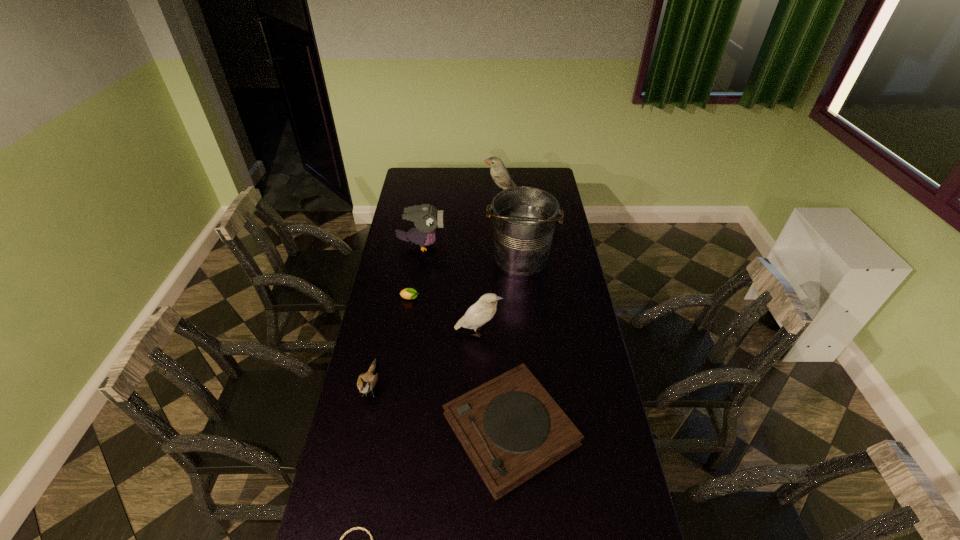
Locate an element on the screen. This screenshot has width=960, height=540. vacant space located at the face of the farthest bird is located at coordinates (468, 194).

Where is `free space located 0.320m at the face of the farthest bird`? The height and width of the screenshot is (540, 960). free space located 0.320m at the face of the farthest bird is located at coordinates (427, 194).

The image size is (960, 540). What are the coordinates of `free region located at the face of the farthest bird` in the screenshot? It's located at (471, 194).

Find the location of a particular element. The height and width of the screenshot is (540, 960). free point located at the beak of the second farthest bird is located at coordinates (527, 246).

Locate an element on the screen. Image resolution: width=960 pixels, height=540 pixels. free location located 0.160m at the beak of the second nearest bird is located at coordinates (542, 332).

Image resolution: width=960 pixels, height=540 pixels. Find the location of `vacant region located 0.300m at the face of the nearest bird`. vacant region located 0.300m at the face of the nearest bird is located at coordinates (347, 502).

Find the location of a particular element. Image resolution: width=960 pixels, height=540 pixels. vacant space located 0.110m on the back of the phonograph record is located at coordinates coord(506,348).

Locate an element on the screen. Image resolution: width=960 pixels, height=540 pixels. vacant space located with leaves positioned above the fifth nearest object is located at coordinates (503, 299).

You are a GUI agent. You are given a task and a screenshot of the screen. Output one action in this format:
    pyautogui.click(x=<x>, y=<y>)
    Task: Click on the lemon located at the left edge
    
    Given the screenshot: What is the action you would take?
    pyautogui.click(x=409, y=293)

I want to click on bucket that is at the right edge, so click(524, 218).